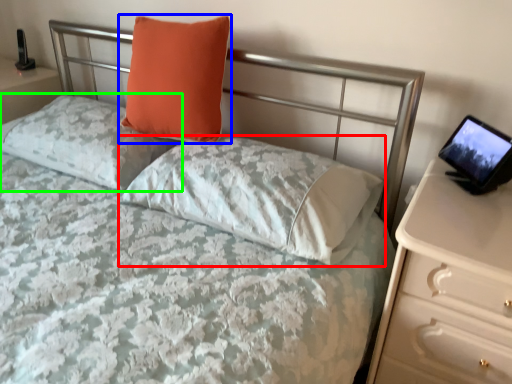
Question: Considering the real-world distances, which object is closest to pillow (highlighted by a red box)? pillow (highlighted by a blue box) or pillow (highlighted by a green box).

Choices:
 (A) pillow
 (B) pillow

Answer: (A)